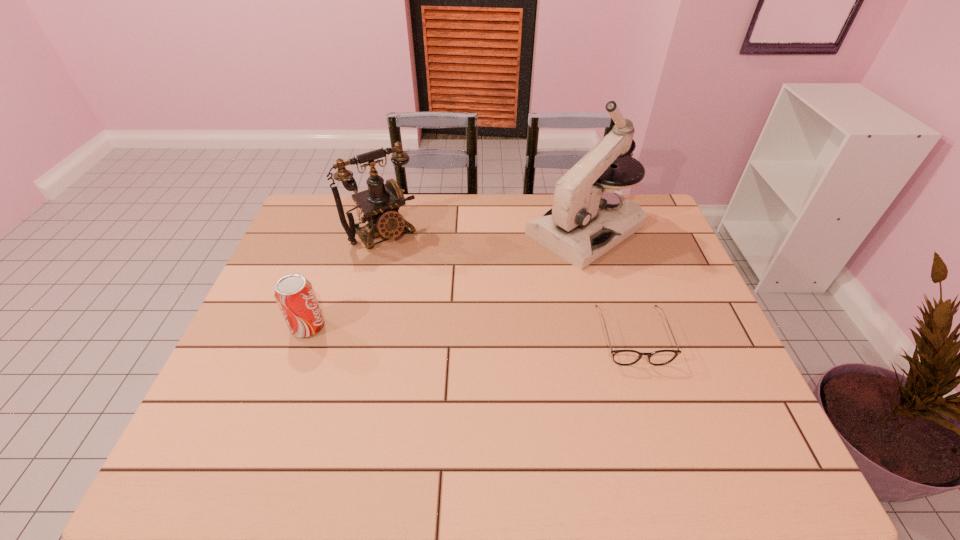
Find the location of a particular element. soda can is located at coordinates (294, 294).

Locate an element on the screen. The width and height of the screenshot is (960, 540). the shortest object is located at coordinates (621, 357).

This screenshot has height=540, width=960. Find the location of `telephone`. telephone is located at coordinates (380, 203).

Find the location of `microscope`. microscope is located at coordinates (588, 218).

You are a GUI agent. You are given a task and a screenshot of the screen. Output one action in this format:
    pyautogui.click(x=<x>, y=<y>)
    Task: Click on the vacant space positioned on the back of the second shortest object
    
    Given the screenshot: What is the action you would take?
    pos(319,295)

Find the location of a particular element. The image size is (960, 540). blank area located through the lenses of the spectacles is located at coordinates (651, 396).

This screenshot has width=960, height=540. I want to click on vacant area situated 0.150m on the rotary dial of the second tallest object, so click(x=420, y=276).

The image size is (960, 540). In order to click on free space located 0.070m on the rotary dial of the second tallest object in this screenshot , I will do `click(408, 261)`.

Identify the location of vacant area located 0.330m on the rotary dial of the second tallest object. The image size is (960, 540). (451, 314).

I want to click on vacant point located 0.350m at the eyepiece of the tallest object, so click(456, 312).